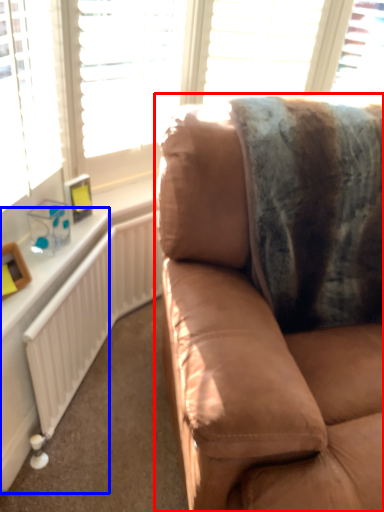
Question: Which of the following is the closest to the observer, studio couch (highlighted by a red box) or table (highlighted by a blue box)?

Choices:
 (A) studio couch
 (B) table

Answer: (A)